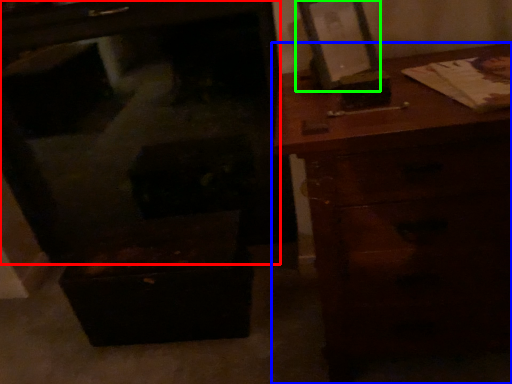
Question: Based on their relative distances, which object is nearer to furniture (highlighted by a red box)? Choose from chest of drawers (highlighted by a blue box) and picture frame (highlighted by a green box).

Choices:
 (A) chest of drawers
 (B) picture frame

Answer: (A)